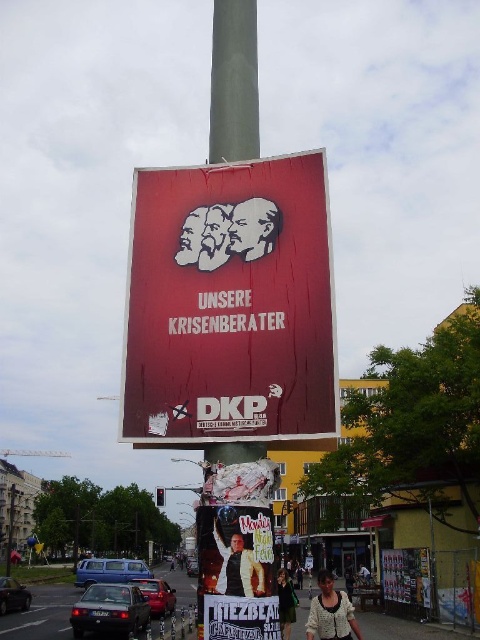
You are standing on the street looking at the scene. Which object is nearer to you between the rusty metal poster at upper center and the light beige sweater at lower center?

The rusty metal poster at upper center is closer to the viewer than the light beige sweater at lower center.

You are a pedestrian on the street looking at the rusty metal poster at upper center and the light beige sweater at lower center. Which object appears smaller in the image?

The rusty metal poster at upper center has a smaller size compared to the light beige sweater at lower center, so the rusty metal poster at upper center appears smaller.

You are a pedestrian standing on the sidewalk looking at the street. You see a metallic gold poster at center and a metallic traffic light at center. Which object is smaller in size?

The metallic gold poster at center is smaller than the metallic traffic light at center according to the description.